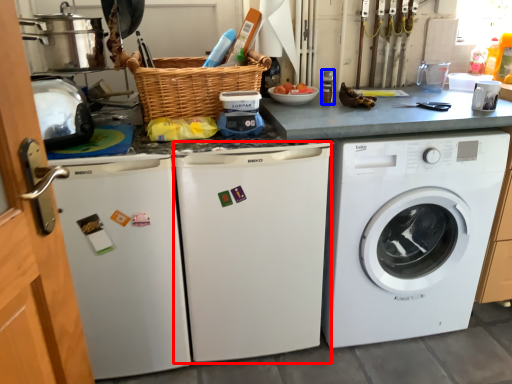
Question: Which object appears closest to the camera in this image, dish washer (highlighted by a red box) or appliance (highlighted by a blue box)?

Choices:
 (A) dish washer
 (B) appliance

Answer: (A)